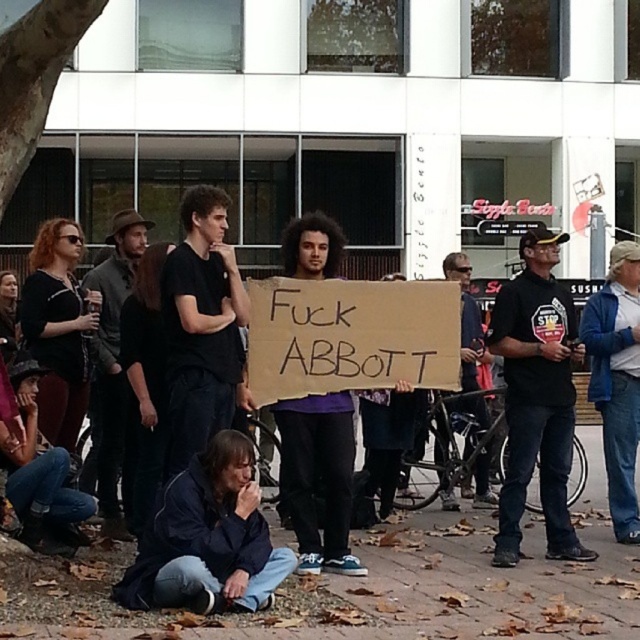
You are a photographer trying to capture a clear shot of the cardboard sign at center and the dark blue shirt at left. Based on their heights, which object would require you to adjust your camera angle upwards to get both in frame?

The dark blue shirt at left is taller than the cardboard sign at center, so you would need to angle your camera upwards to include both in the frame.